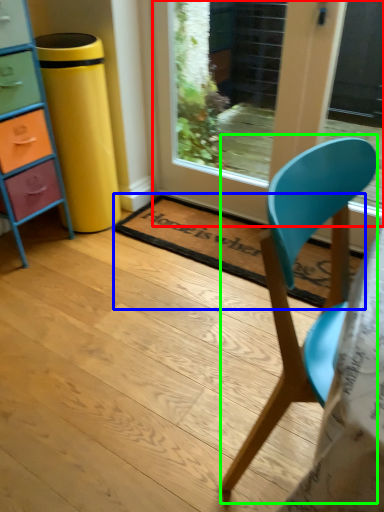
Question: Which is farther away from door (highlighted by a red box)? mat (highlighted by a blue box) or chair (highlighted by a green box)?

Choices:
 (A) mat
 (B) chair

Answer: (B)